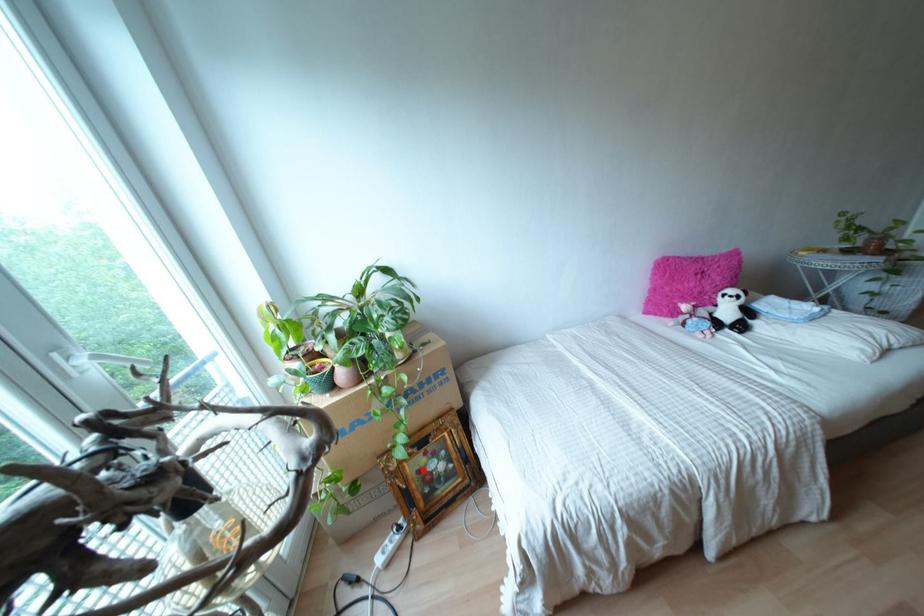
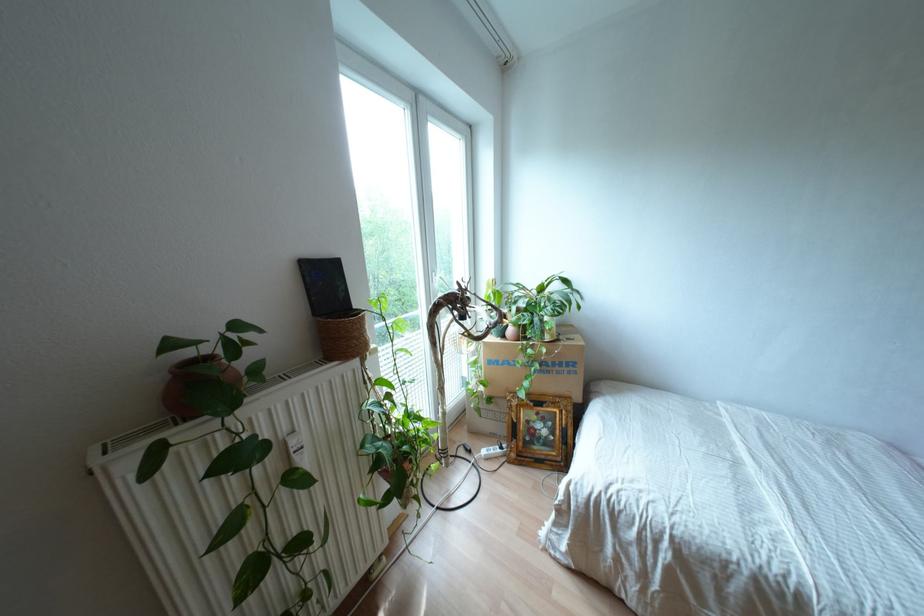
Where in the second image is the point corresponding to the highlighted location from the first image?

(530, 424)